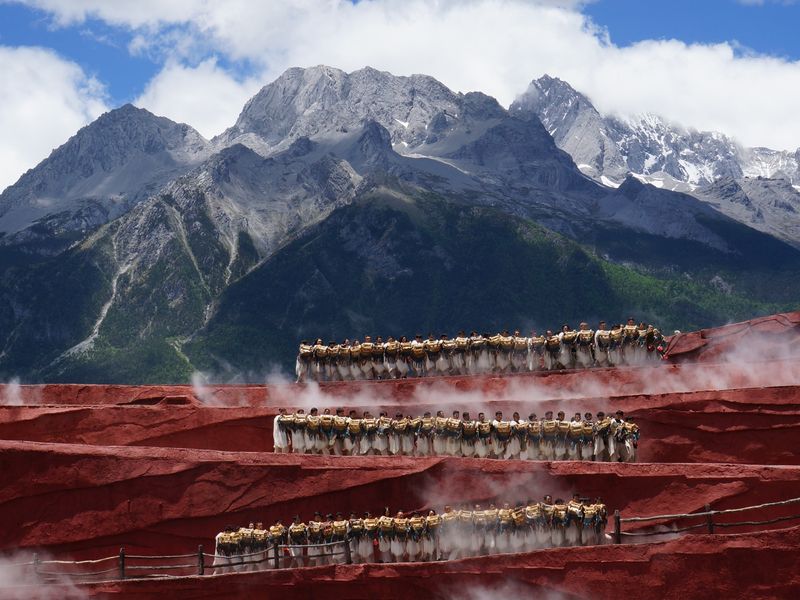
Locate an element on the screen. The width and height of the screenshot is (800, 600). red walls is located at coordinates (606, 571), (310, 493), (692, 415), (117, 392).